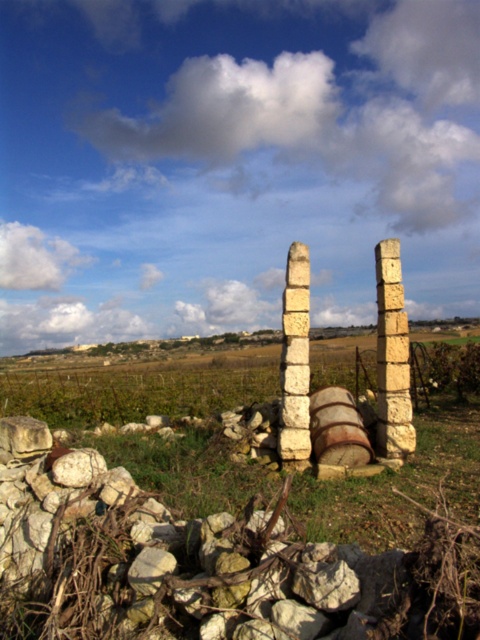
Question: In this image, where is light beige stone pillar at right located relative to white stone pillar at center?

Choices:
 (A) below
 (B) above

Answer: (B)

Question: Does light beige stone pillar at right have a lesser width compared to white stone pillar at center?

Choices:
 (A) no
 (B) yes

Answer: (A)

Question: Which point appears farthest from the camera in this image?

Choices:
 (A) (301, 276)
 (B) (388, 426)

Answer: (A)

Question: Does light beige stone pillar at right have a lesser width compared to white stone pillar at center?

Choices:
 (A) yes
 (B) no

Answer: (B)